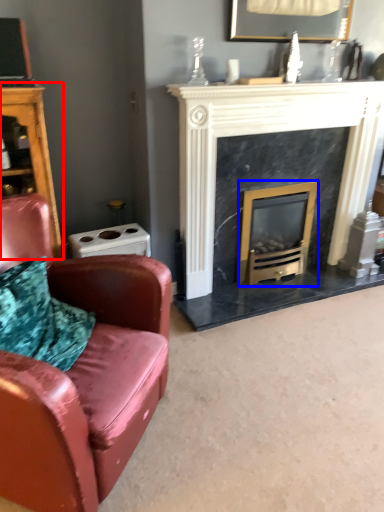
Question: Which object appears farthest to the camera in this image, dresser (highlighted by a red box) or wood burning stove (highlighted by a blue box)?

Choices:
 (A) dresser
 (B) wood burning stove

Answer: (B)